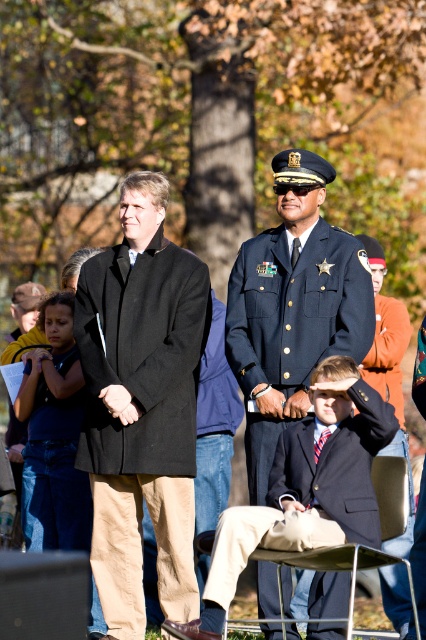
Who is positioned more to the right, black wool coat at center or light blue fabric uniform at center?

light blue fabric uniform at center is more to the right.

Between point (131, 572) and point (259, 376), which one is positioned in front?

Point (131, 572) is in front.

I want to click on black wool coat at center, so click(x=141, y=406).

Is point (233, 323) behind point (63, 369)?

That is False.

Is point (276, 336) less distant than point (60, 536)?

Yes, it is in front of point (60, 536).

Find the location of a particular element. The width and height of the screenshot is (426, 640). light blue fabric uniform at center is located at coordinates (291, 323).

Which is more to the left, light blue fabric uniform at center or dark blue suit at center?

Positioned to the left is light blue fabric uniform at center.

Who is more forward, (290,333) or (363,520)?

Point (363,520) is in front.

In the scene shown: Measure the distance between point (267, 625) and camera.

Point (267, 625) is 12.19 meters away from camera.

Image resolution: width=426 pixels, height=640 pixels. I want to click on light blue fabric uniform at center, so click(291, 323).